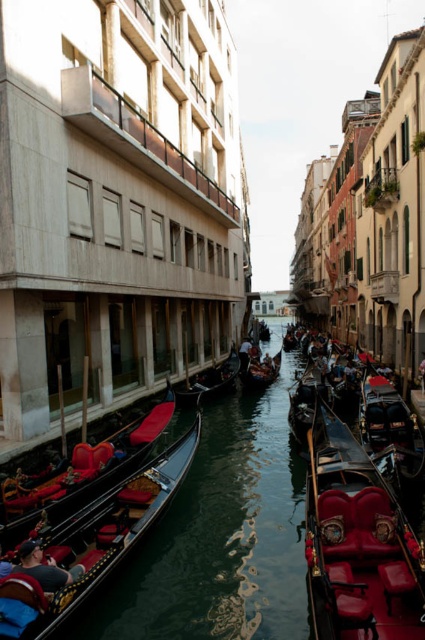
Question: Is polished wood gondola at center thinner than shiny black gondola at right?

Choices:
 (A) yes
 (B) no

Answer: (A)

Question: Does polished wood gondola at center appear over shiny black gondola at right?

Choices:
 (A) no
 (B) yes

Answer: (A)

Question: Which of these objects is positioned farthest from the polished wood gondola at center?

Choices:
 (A) wooden gondola at center
 (B) shiny black gondola at right

Answer: (A)

Question: Among these objects, which one is nearest to the camera?

Choices:
 (A) wooden gondola at center
 (B) shiny black gondola at right
 (C) polished wood gondola at center

Answer: (C)

Question: Where is polished wood gondola at center located in relation to wooden gondola at center in the image?

Choices:
 (A) above
 (B) below

Answer: (B)

Question: Which is nearer to the polished wood gondola at center?

Choices:
 (A) shiny black gondola at right
 (B) wooden gondola at center

Answer: (A)